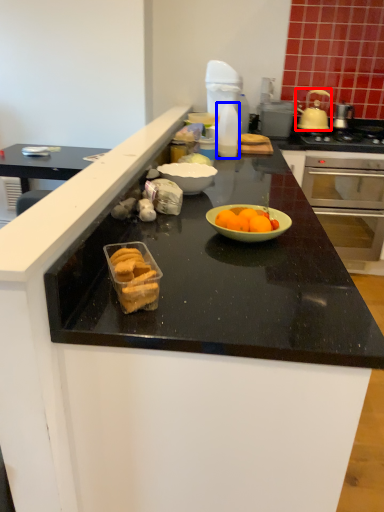
Question: Which object appears farthest to the camera in this image, pot/pan (highlighted by a red box) or bottle (highlighted by a blue box)?

Choices:
 (A) pot/pan
 (B) bottle

Answer: (A)